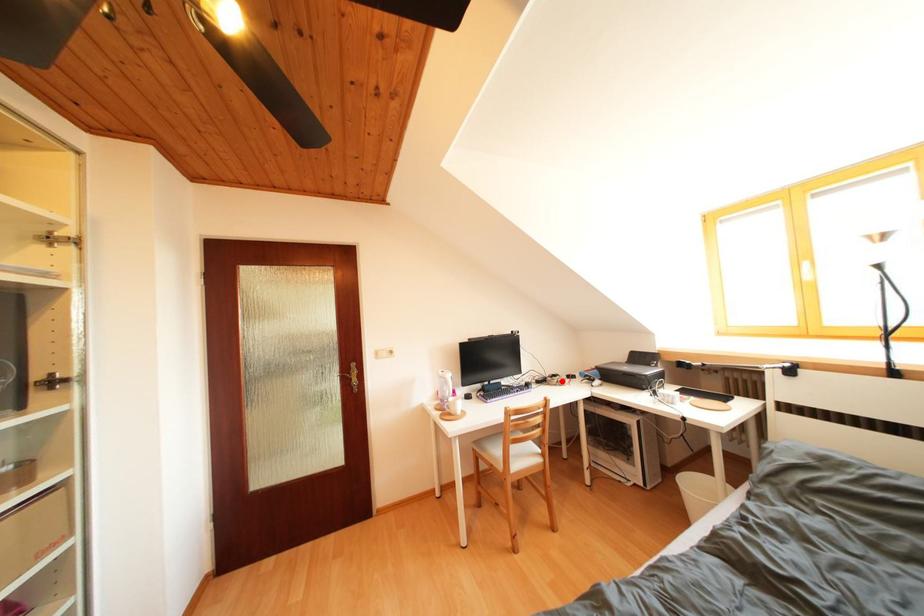
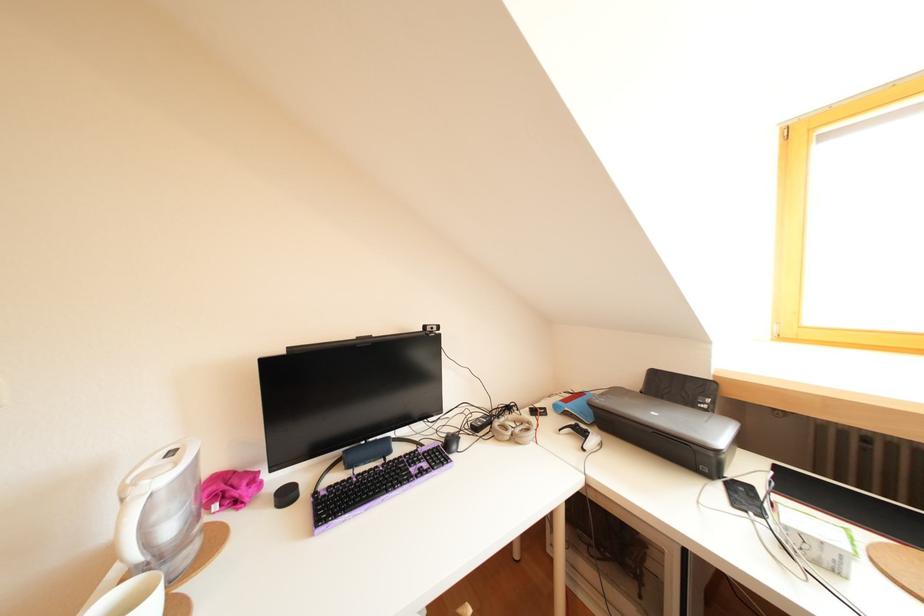
Question: A red point is marked in image1. In image2, is the corresponding 3D point closer to the camera or farther? Reply with the corresponding letter.

Choices:
 (A) The corresponding 3D point is closer.
 (B) The corresponding 3D point is farther.

Answer: (A)